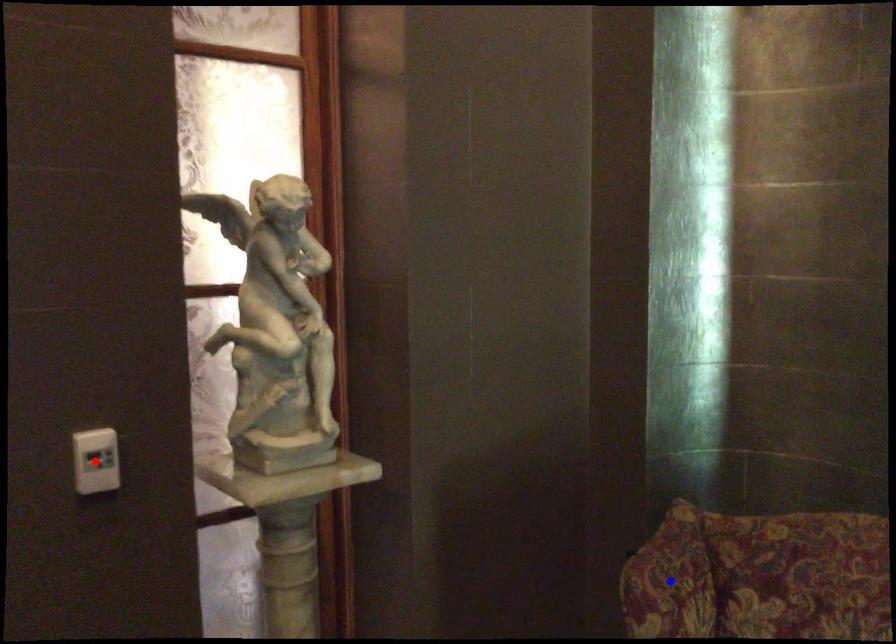
Question: Two points are marked on the image. Which point is closer to the camera?

Choices:
 (A) Blue point is closer.
 (B) Red point is closer.

Answer: (B)